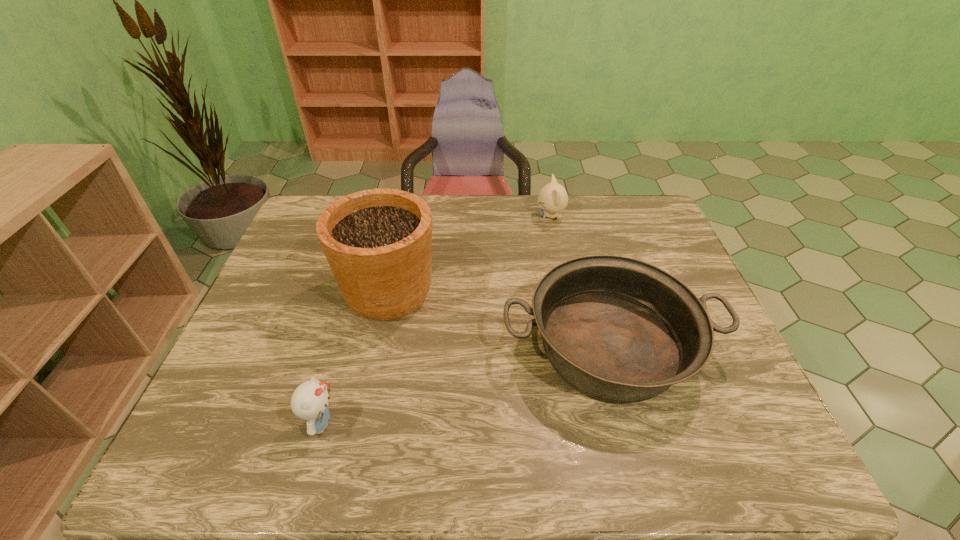
Find the location of a particular element. This screenshot has height=540, width=960. free space that satisfies the following two spatial constraints: 1. on the face of the right kitten; 2. on the front side of the flowerpot is located at coordinates (566, 292).

Where is `blank space that satisfies the following two spatial constraints: 1. on the face of the farther kitten; 2. on the front side of the flowerpot`? blank space that satisfies the following two spatial constraints: 1. on the face of the farther kitten; 2. on the front side of the flowerpot is located at coordinates (566, 292).